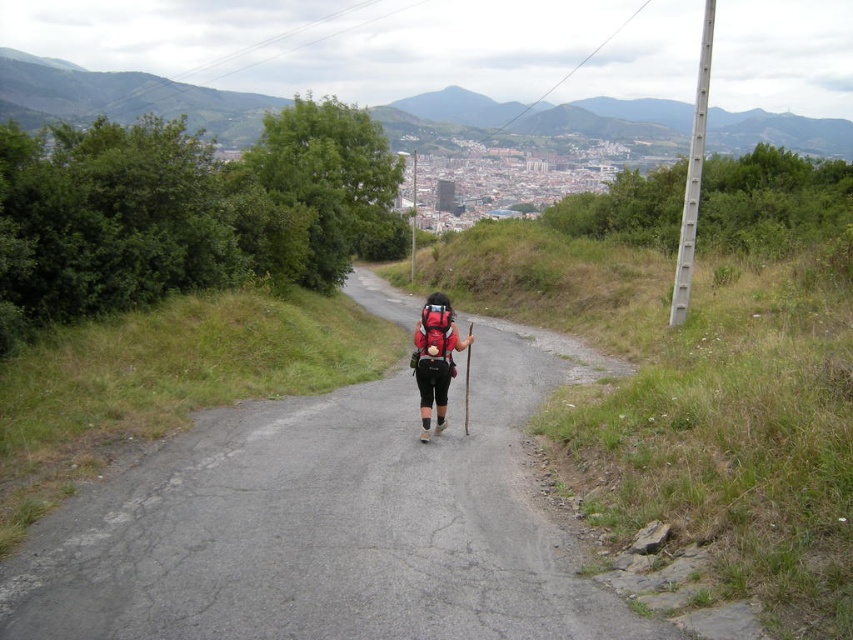
Question: Does asphalt road at center appear over matte black backpack at center?

Choices:
 (A) yes
 (B) no

Answer: (B)

Question: Does asphalt road at center have a greater width compared to matte black backpack at center?

Choices:
 (A) yes
 (B) no

Answer: (A)

Question: Is asphalt road at center above matte black backpack at center?

Choices:
 (A) yes
 (B) no

Answer: (B)

Question: Which of the following is the farthest from the observer?

Choices:
 (A) matte black backpack at center
 (B) asphalt road at center

Answer: (A)